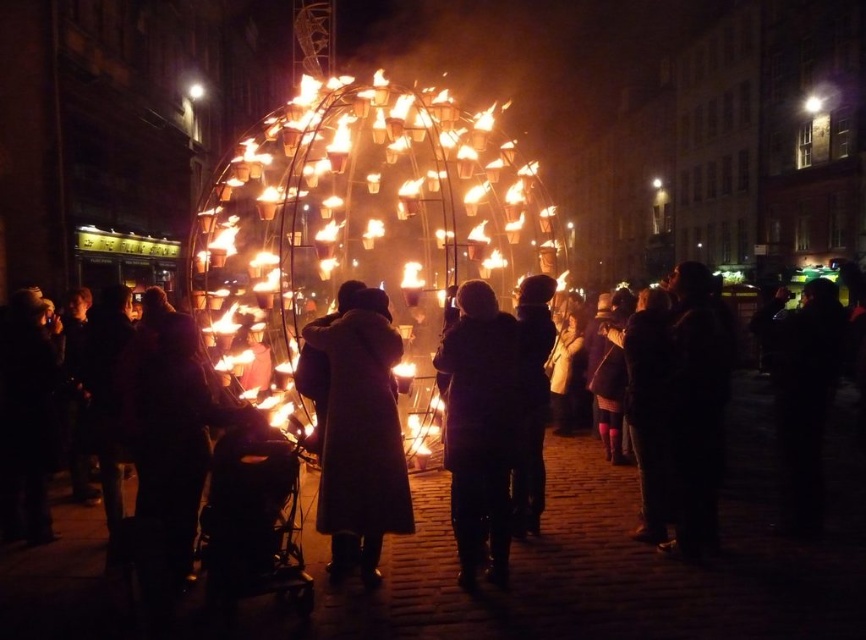
You are a photographer trying to capture both the dark wool coat at center and the dark gray coat at center in a single frame. Given that your camera has a limited focus range, which coat should you focus on to ensure the other remains in the background?

The dark wool coat at center is bigger than the dark gray coat at center, so focusing on the dark wool coat at center will keep the smaller dark gray coat at center in the background within the focus range.

You are a photographer trying to capture both the matte black coat at center and the dark wool coat at center in a single shot. Since you want to ensure both are fully visible, which coat should you focus on to avoid cropping the taller one?

The dark wool coat at center is taller than the matte black coat at center, so focusing on the dark wool coat at center will ensure the taller one is fully visible without cropping.